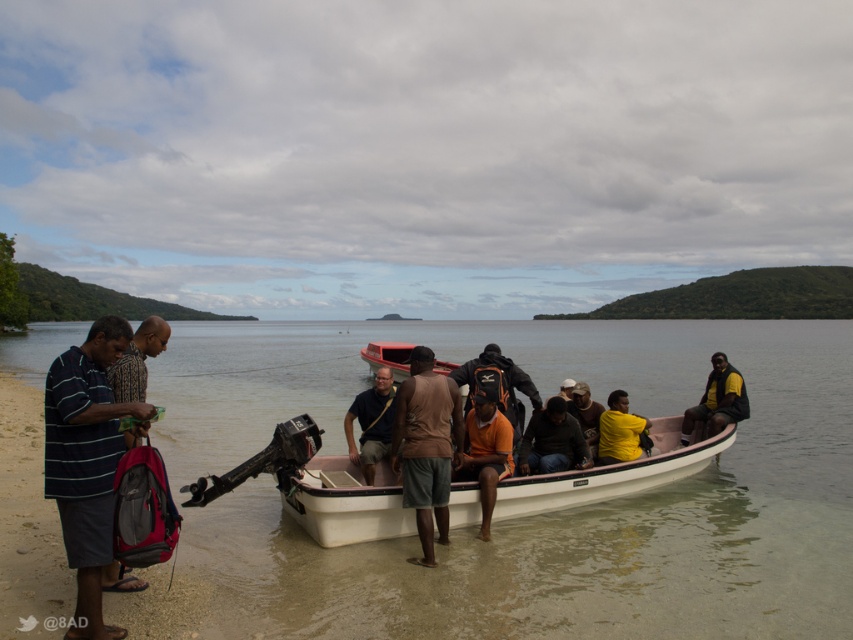
Question: Which object is farther from the camera taking this photo?

Choices:
 (A) yellow matte shirt at center
 (B) dark brown leather jacket at center

Answer: (A)

Question: Which of these objects is positioned farthest from the matte brown shirt at center?

Choices:
 (A) brown leather jacket at center
 (B) orange matte shirt at center
 (C) striped fabric shirt at left
 (D) brown cotton shirt at center

Answer: (C)

Question: Is clear water at boat center below yellow-green fabric shirt at right?

Choices:
 (A) no
 (B) yes

Answer: (A)

Question: Does matte black backpack at lower left lie in front of brown leather jacket at center?

Choices:
 (A) yes
 (B) no

Answer: (A)

Question: Which point is farther to the camera?

Choices:
 (A) yellow-green fabric shirt at right
 (B) matte black backpack at lower left

Answer: (A)

Question: Where is brown cotton shirt at center located in relation to dark brown leather jacket at center in the image?

Choices:
 (A) right
 (B) left

Answer: (B)